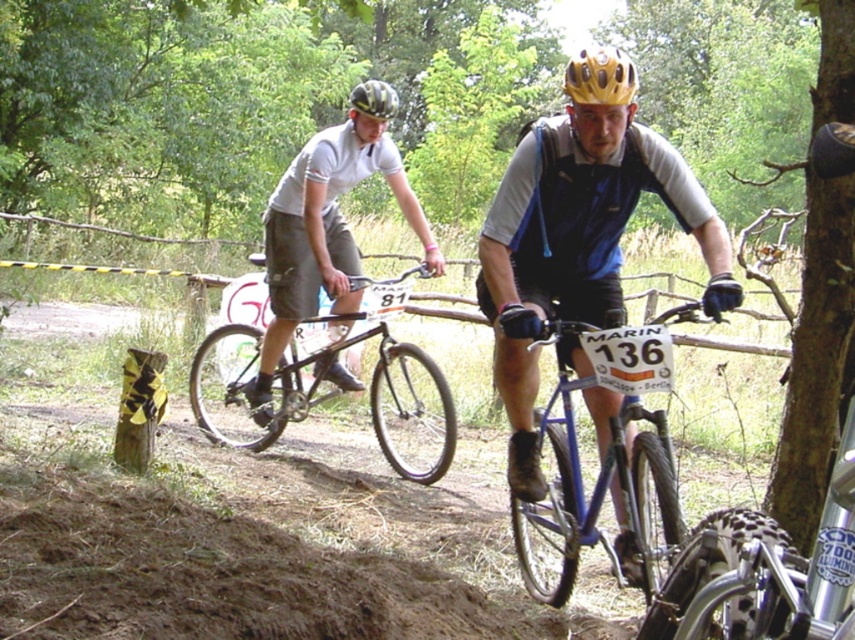
Question: Can you confirm if blue matte bicycle at center is thinner than matte black helmet at upper center?

Choices:
 (A) yes
 (B) no

Answer: (A)

Question: Does black matte bicycle at center appear over matte black helmet at upper center?

Choices:
 (A) yes
 (B) no

Answer: (B)

Question: Estimate the real-world distances between objects in this image. Which object is farther from the blue metallic bicycle at center?

Choices:
 (A) matte black bicycle at left
 (B) yellow matte bicycle helmet at upper center
 (C) blue matte bicycle at center
 (D) matte black helmet at upper center

Answer: (D)

Question: Among these objects, which one is farthest from the camera?

Choices:
 (A) matte black helmet at upper center
 (B) blue metallic bicycle at center
 (C) yellow matte bicycle helmet at upper center
 (D) black matte bicycle at center

Answer: (A)

Question: Is blue matte bicycle at center to the left of yellow matte bicycle helmet at upper center from the viewer's perspective?

Choices:
 (A) no
 (B) yes

Answer: (A)

Question: Estimate the real-world distances between objects in this image. Which object is farther from the matte black helmet at upper center?

Choices:
 (A) yellow matte bicycle helmet at upper center
 (B) blue matte bicycle at center
 (C) blue metallic bicycle at center
 (D) matte black bicycle at left

Answer: (A)